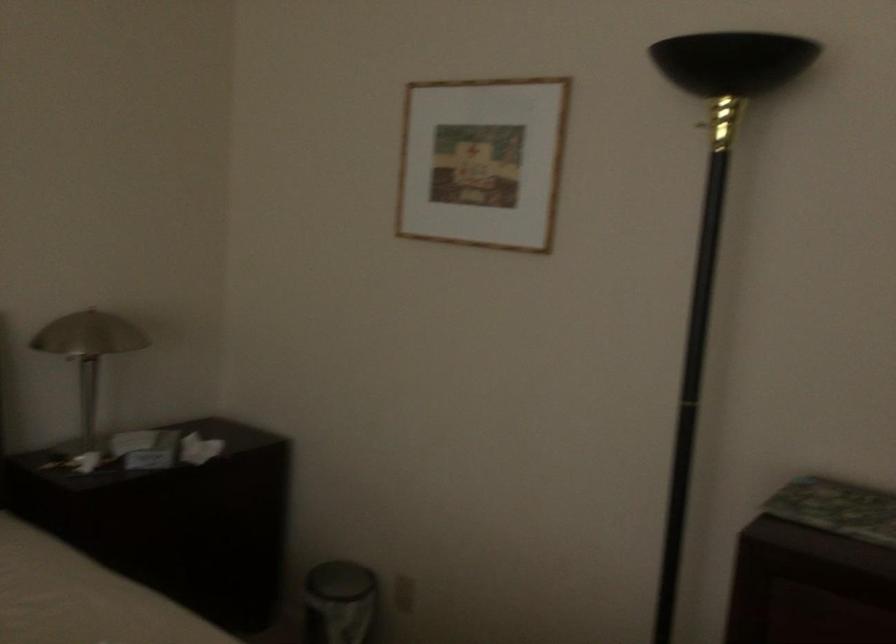
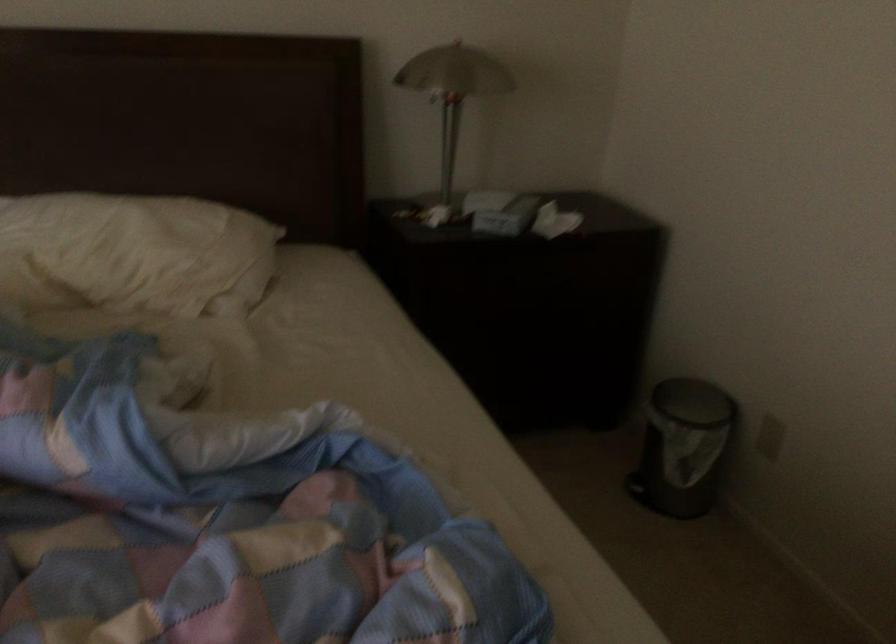
Find the pixel in the second image that matches pixel 97 348 in the first image.

(453, 91)